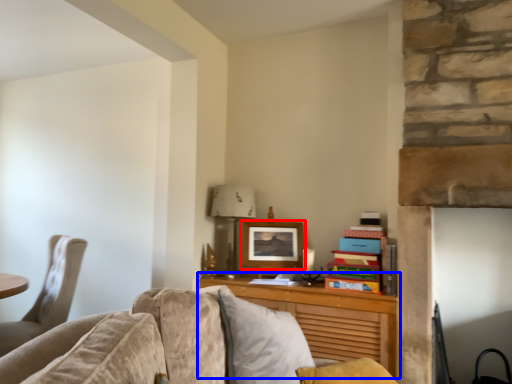
Question: Among these objects, which one is farthest to the camera, picture frame (highlighted by a red box) or desk (highlighted by a blue box)?

Choices:
 (A) picture frame
 (B) desk

Answer: (A)